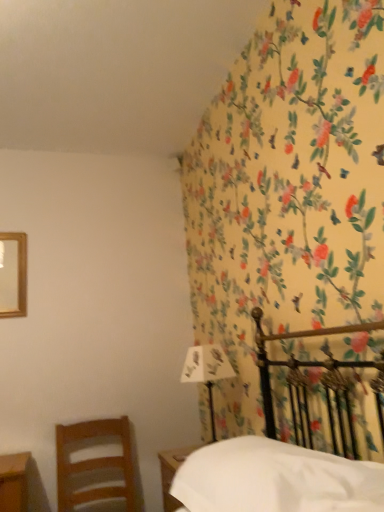
Question: Does white paper at upper right lie behind wooden nightstand at lower center?

Choices:
 (A) yes
 (B) no

Answer: (A)

Question: From the image's perspective, is white paper at upper right above wooden nightstand at lower center?

Choices:
 (A) no
 (B) yes

Answer: (B)

Question: Is white paper at upper right outside of wooden nightstand at lower center?

Choices:
 (A) yes
 (B) no

Answer: (A)

Question: Can you confirm if white paper at upper right is smaller than wooden nightstand at lower center?

Choices:
 (A) no
 (B) yes

Answer: (B)

Question: Is the surface of white paper at upper right in direct contact with wooden nightstand at lower center?

Choices:
 (A) no
 (B) yes

Answer: (A)

Question: From a real-world perspective, is white paper at upper right on wooden nightstand at lower center?

Choices:
 (A) no
 (B) yes

Answer: (B)

Question: From the image's perspective, is wooden nightstand at lower center beneath white paper at upper right?

Choices:
 (A) no
 (B) yes

Answer: (B)

Question: From a real-world perspective, is wooden nightstand at lower center on white paper at upper right?

Choices:
 (A) no
 (B) yes

Answer: (A)

Question: Is wooden nightstand at lower center positioned before white paper at upper right?

Choices:
 (A) yes
 (B) no

Answer: (A)

Question: From a real-world perspective, does wooden nightstand at lower center sit lower than white paper at upper right?

Choices:
 (A) yes
 (B) no

Answer: (A)

Question: Could you tell me if wooden nightstand at lower center is facing white paper at upper right?

Choices:
 (A) no
 (B) yes

Answer: (A)

Question: Does wooden nightstand at lower center appear on the left side of white paper at upper right?

Choices:
 (A) no
 (B) yes

Answer: (B)

Question: Does white matte sheet at lower right have a smaller size compared to wooden chair at left?

Choices:
 (A) no
 (B) yes

Answer: (A)